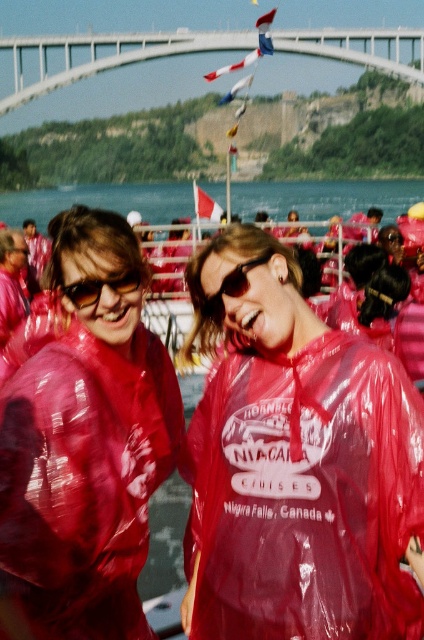
Question: Which of the following is the farthest from the observer?

Choices:
 (A) matte black sunglasses at left
 (B) glossy plastic poncho at center
 (C) white concrete bridge at upper center

Answer: (C)

Question: Can you confirm if transparent plastic raincoat at center is wider than matte black sunglasses at left?

Choices:
 (A) no
 (B) yes

Answer: (B)

Question: Does transparent plastic raincoat at center have a greater width compared to glossy plastic poncho at center?

Choices:
 (A) no
 (B) yes

Answer: (B)

Question: Estimate the real-world distances between objects in this image. Which object is closer to the transparent plastic raincoat at center?

Choices:
 (A) glossy plastic poncho at center
 (B) matte black sunglasses at left
 (C) sunglasses at center

Answer: (A)

Question: Can you confirm if white concrete bridge at upper center is positioned to the left of sunglasses at center?

Choices:
 (A) no
 (B) yes

Answer: (B)

Question: Among these objects, which one is farthest from the camera?

Choices:
 (A) white concrete bridge at upper center
 (B) matte black sunglasses at left

Answer: (A)